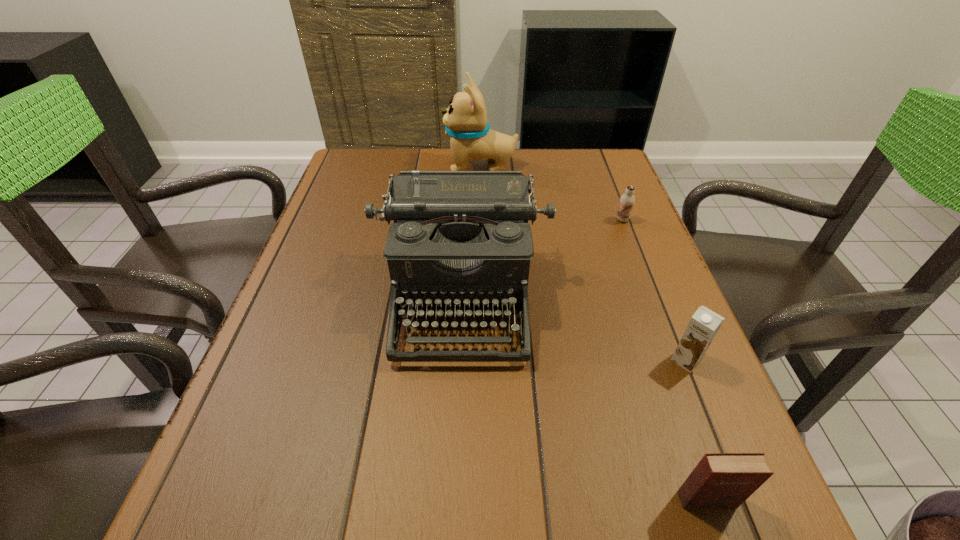
I want to click on free space at the far left corner, so click(x=376, y=160).

The height and width of the screenshot is (540, 960). In the image, there is a desktop. Find the location of `vacant space at the far right corner`. vacant space at the far right corner is located at coordinates (582, 150).

The height and width of the screenshot is (540, 960). Identify the location of vacant region at the near right corner. (673, 508).

Locate an element on the screen. blank region between the shortest object and the puppy is located at coordinates (551, 193).

Where is `vacant space that's between the shorter chocolate milk and the taller chocolate milk`? This screenshot has height=540, width=960. vacant space that's between the shorter chocolate milk and the taller chocolate milk is located at coordinates (654, 290).

Where is `free space between the taller chocolate milk and the puppy`? This screenshot has width=960, height=540. free space between the taller chocolate milk and the puppy is located at coordinates (584, 263).

The image size is (960, 540). I want to click on free space between the taller chocolate milk and the second tallest object, so click(574, 329).

The image size is (960, 540). I want to click on vacant space that is in between the nearest object and the farthest object, so click(593, 333).

Identify the location of empty space between the diary and the taller chocolate milk. The height and width of the screenshot is (540, 960). click(696, 430).

Locate an element on the screen. This screenshot has width=960, height=540. vacant area that lies between the nearest object and the taller chocolate milk is located at coordinates (696, 430).